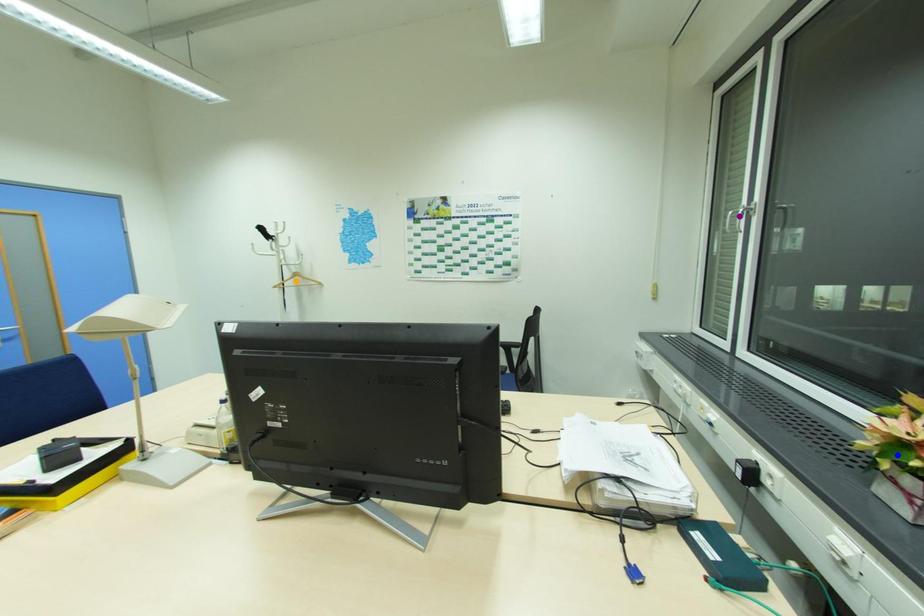
Consider the image. Order these from nearest to farthest:
orange point
blue point
purple point

blue point
purple point
orange point